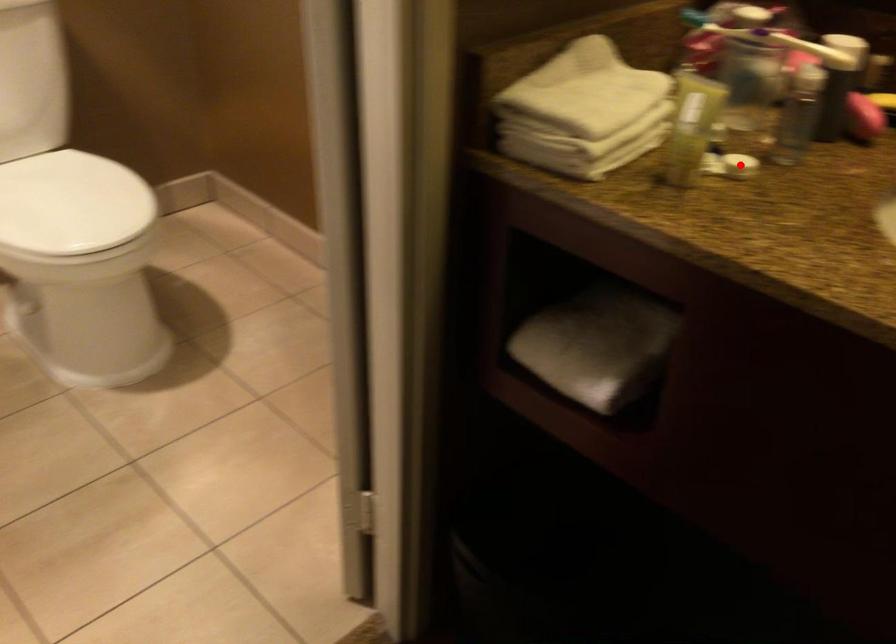
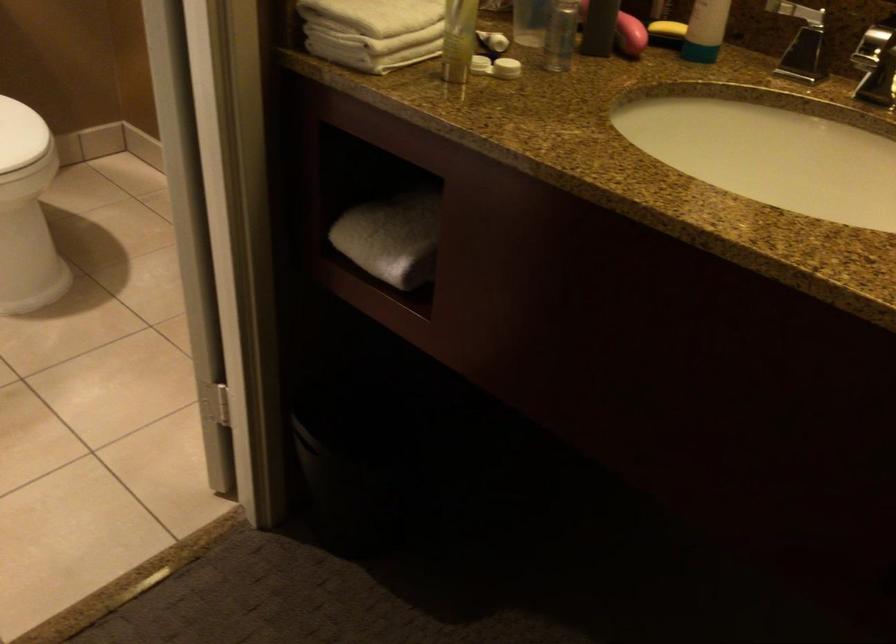
Question: I am providing you with two images of the same scene from different viewpoints. Image1 has a red point marked. In image2, the corresponding 3D location appears at what relative position? Reply with the corresponding letter.

Choices:
 (A) Closer
 (B) Farther

Answer: (B)